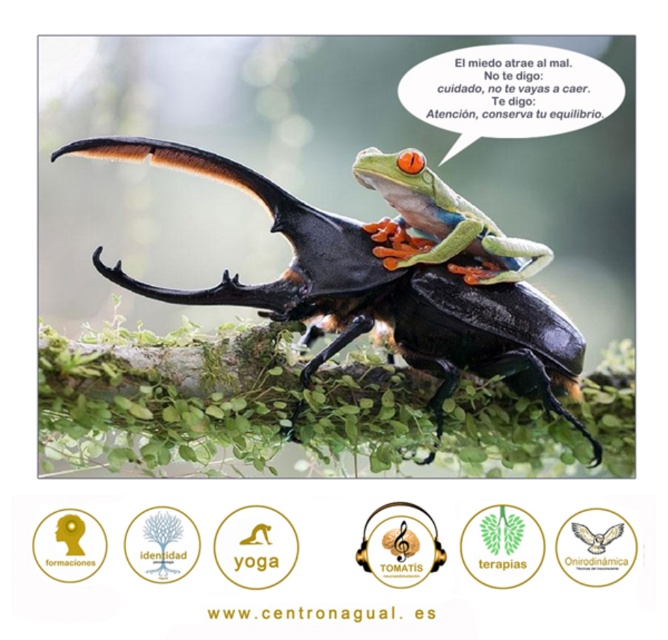
You are an observer looking at the scene. Which object is positioned to the left of the other between the shiny black beetle at center and the shiny green frog at center?

The shiny black beetle at center is to the left of the shiny green frog at center.

You are a photographer trying to capture a frog sitting on a beetle in a forest. You notice a point at coordinates point (96, 147) that is 1.14 meters away from the camera. If your camera has a depth of field that can focus clearly up to 1.2 meters, will the frog be in focus?

The point at point (96, 147) is 1.14 meters away from the camera. Since the frog is sitting on the beetle and the point is within the camera depth of field range of up to 1.2 meters, the frog will be in focus.

You are a photographer trying to capture a clear photo of the shiny black beetle at center and the shiny green frog at center. Which one will appear larger in your photo?

The shiny black beetle at center will appear larger in the photo because it is closer to the viewer than the shiny green frog at center.